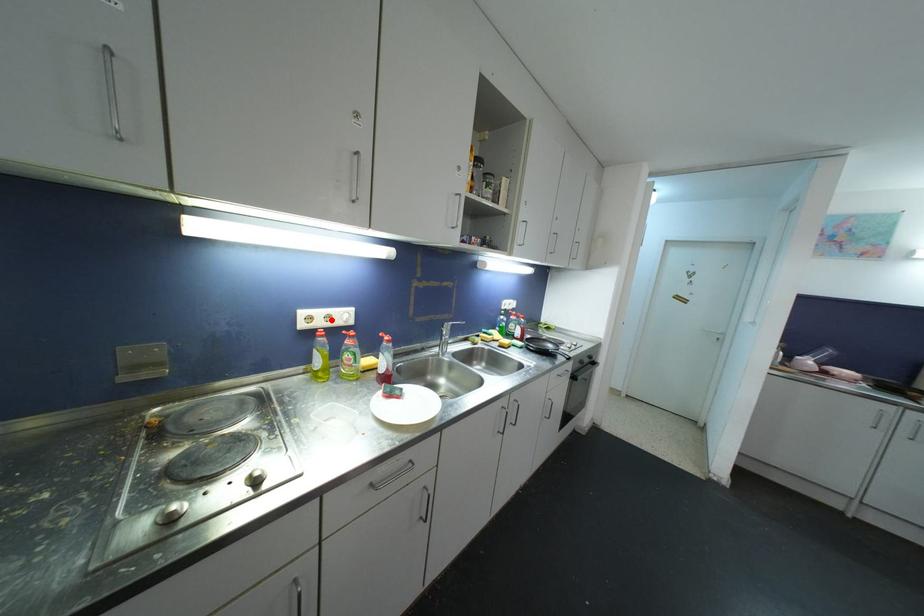
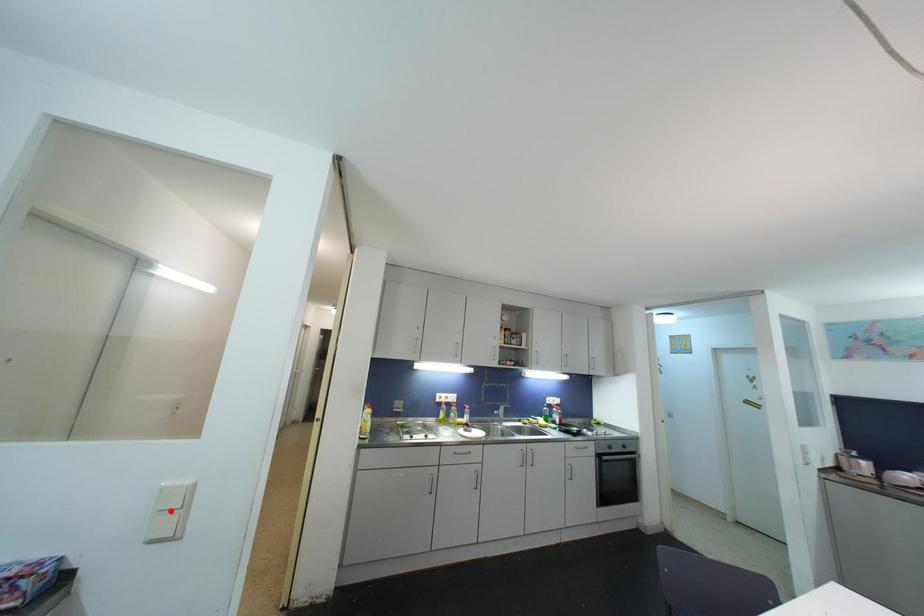
I am providing you with two images of the same scene from different viewpoints. A red point is marked on the first image and another point is marked on the second image. Are the points marked in image1 and image2 representing the same 3D position?

No